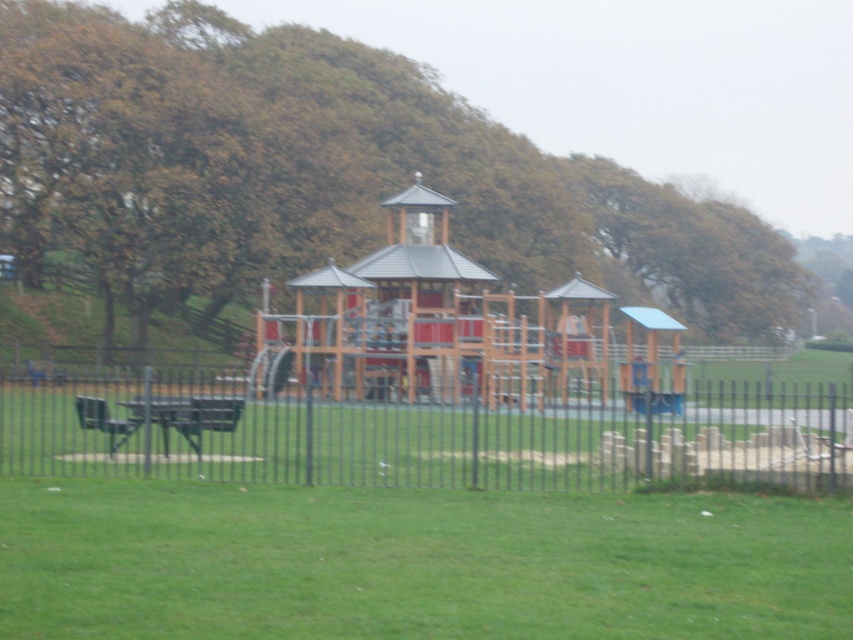
Question: Does brown wood tree at center have a smaller size compared to green grass at lower center?

Choices:
 (A) yes
 (B) no

Answer: (B)

Question: Considering the real-world distances, which object is closest to the brown wood tree at center?

Choices:
 (A) green grass at lower center
 (B) black metal fence at center

Answer: (B)

Question: Which object is closer to the camera taking this photo?

Choices:
 (A) black metal fence at center
 (B) brown wood tree at center
 (C) green grass at lower center
 (D) wooden gazebo at center

Answer: (C)

Question: Is brown wood tree at center to the left of black metal fence at center from the viewer's perspective?

Choices:
 (A) no
 (B) yes

Answer: (A)

Question: Which is nearer to the brown wood tree at center?

Choices:
 (A) wooden gazebo at center
 (B) green grass at lower center
 (C) black metal fence at center

Answer: (A)

Question: Is brown wood tree at center closer to the viewer compared to wooden gazebo at center?

Choices:
 (A) yes
 (B) no

Answer: (B)